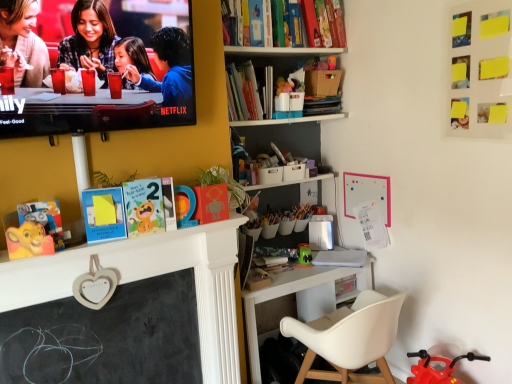
Where is `free space above black chalkboard at center-left (from a real-world perspective)`? This screenshot has width=512, height=384. free space above black chalkboard at center-left (from a real-world perspective) is located at coordinates (106, 288).